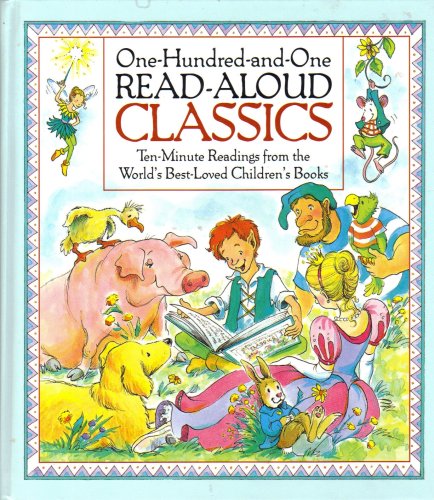
Can you see any open book, with a green outlined cover and a white background. the picture is vague, but seems a lot like the overall cover we 're looking at here in the image? Point to them. Your answer should be formatted as a list of tuples, i.e. [(x1, y1), (x2, y2), ...], where each tuple contains the x and y coordinates of a point satisfying the conditions above.

[(249, 346)]